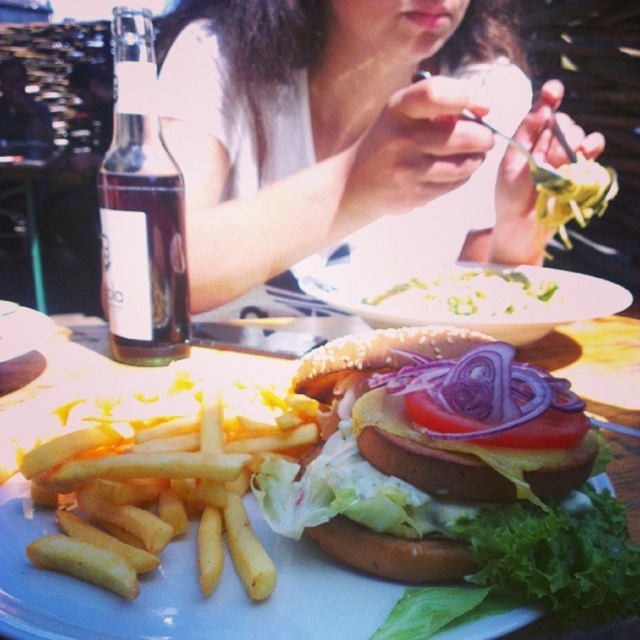
Question: Which of the following is the farthest from the observer?

Choices:
 (A) translucent glass bottle at lower left
 (B) white porcelain plate at center

Answer: (B)

Question: Is white paper plate at center bigger than white porcelain plate at center?

Choices:
 (A) yes
 (B) no

Answer: (A)

Question: Which point appears farthest from the camera in this image?

Choices:
 (A) (353, 426)
 (B) (339, 211)
 (C) (406, 324)

Answer: (B)

Question: Which object appears farthest from the camera in this image?

Choices:
 (A) white porcelain plate at center
 (B) shiny brown bun at center

Answer: (A)

Question: Does golden crispy french fries at lower left have a smaller size compared to smooth creamy pasta at center?

Choices:
 (A) yes
 (B) no

Answer: (A)

Question: Can you confirm if translucent glass bottle at lower left is wider than white paper plate at center?

Choices:
 (A) no
 (B) yes

Answer: (A)